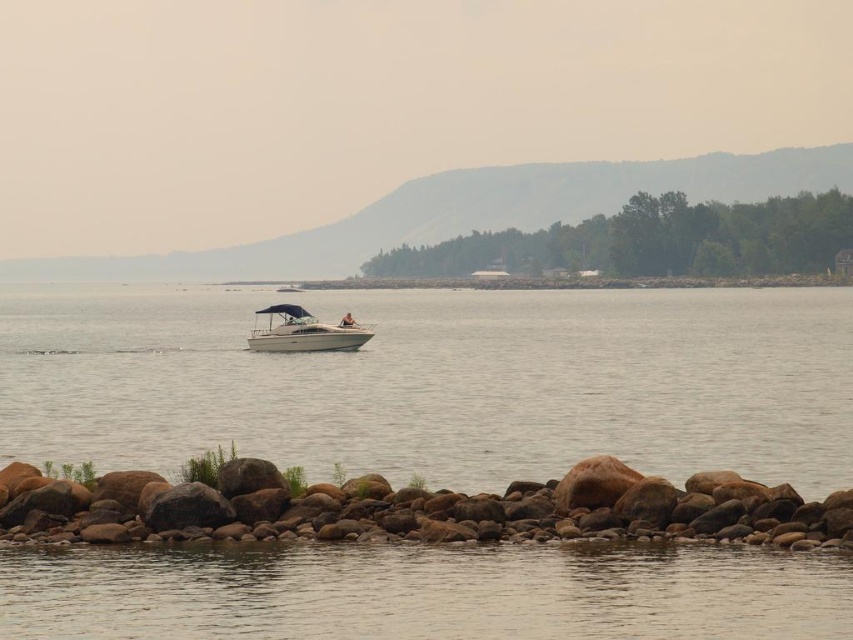
You are standing on the rocky shoreline and want to reach the white glossy boat at center. Which object, the brown rock at lower center or the boat, would you encounter first as you walk towards the boat?

The brown rock at lower center is in front of the white glossy boat at center, so you would encounter the brown rock at lower center first as you walk towards the boat.

You are standing at the lakeside and want to reach both the point at coordinates point [122,356] and point [561,477]. Which point should you head to first if you want to reach the closer one first?

You should head to point [122,356] first because it is closer to you than point [561,477], which is further away.

You are standing on the rocky shoreline and want to board the white glossy boat at center. Which direction should you walk to reach the boat from the brown rock at lower center?

The brown rock at lower center is to the right of the white glossy boat at center, so you should walk to the left to reach the boat from the brown rock at lower center.